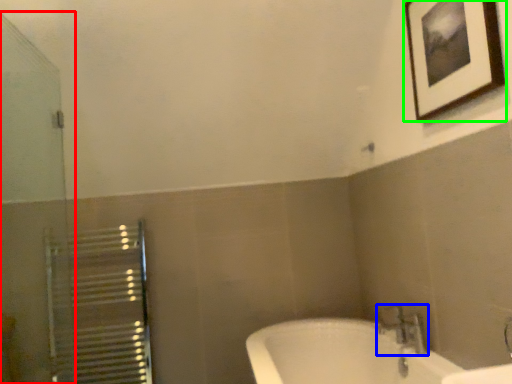
Question: Which is farther away from screen door (highlighted by a red box)? tap (highlighted by a blue box) or picture frame (highlighted by a green box)?

Choices:
 (A) tap
 (B) picture frame

Answer: (A)